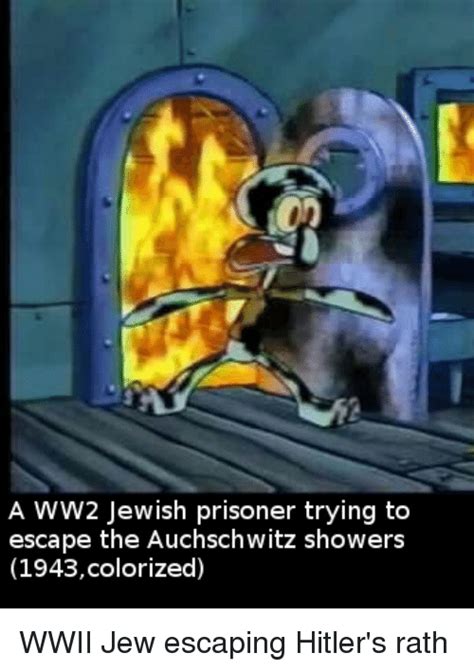
You are a GUI agent. You are given a task and a screenshot of the screen. Output one action in this format:
    pyautogui.click(x=<x>, y=<y>)
    Task: Click on the doorway
    This screenshot has width=474, height=671.
    Given the screenshot: What is the action you would take?
    pyautogui.click(x=96, y=325)